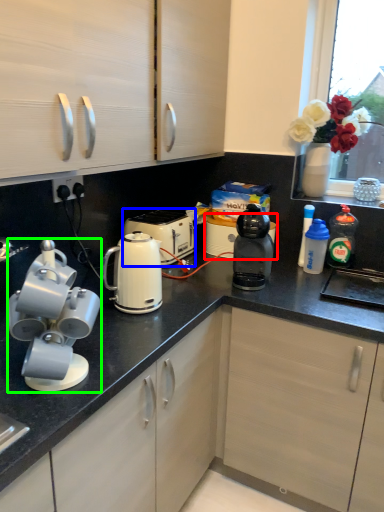
Question: Considering the real-world distances, which object is farthest from appliance (highlighted by a red box)? kettle (highlighted by a blue box) or home appliance (highlighted by a green box)?

Choices:
 (A) kettle
 (B) home appliance

Answer: (B)